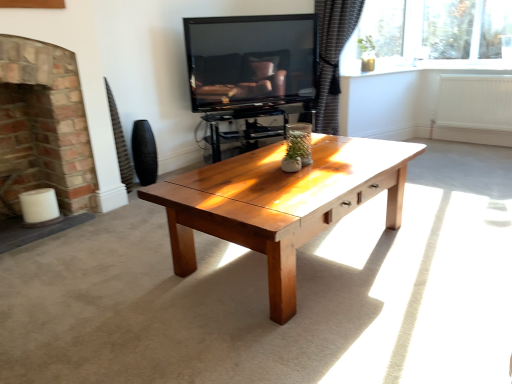
Where is `free space in front of white painted radiator at right`? This screenshot has width=512, height=384. free space in front of white painted radiator at right is located at coordinates (x=475, y=154).